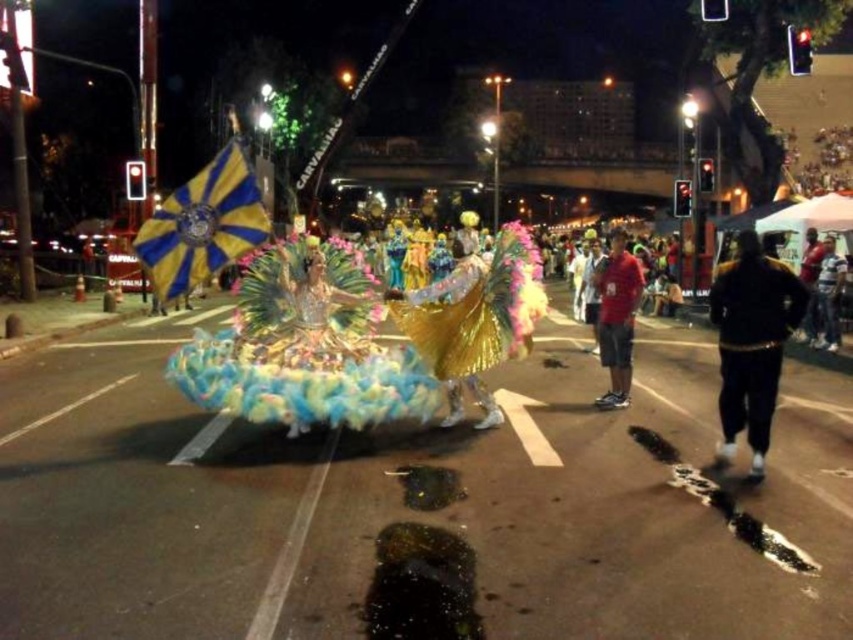
You are a photographer trying to capture the performers on the float. You notice the shiny gold costume at center and the red matte shirt at center. Which performer is positioned lower in the photo?

The shiny gold costume at center is located below the red matte shirt at center, so the performer in the shiny gold costume at center is positioned lower in the photo.